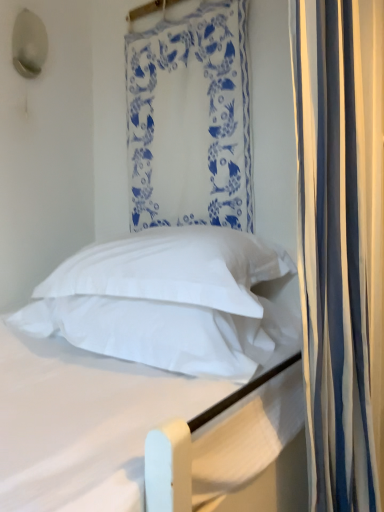
Question: Is white soft bed at center with white fabric at upper center, the 2th curtain when ordered from right to left?

Choices:
 (A) yes
 (B) no

Answer: (B)

Question: From the image's perspective, is white soft bed at center beneath white fabric at upper center, the 2th curtain in the front-to-back sequence?

Choices:
 (A) yes
 (B) no

Answer: (A)

Question: Is white fabric at upper center, positioned as the 1th curtain in left-to-right order, surrounded by white soft bed at center?

Choices:
 (A) yes
 (B) no

Answer: (B)

Question: Does white soft bed at center turn towards white fabric at upper center, placed as the 1th curtain when sorted from back to front?

Choices:
 (A) yes
 (B) no

Answer: (B)

Question: Considering the relative sizes of white soft bed at center and white fabric at upper center, the 2th curtain when ordered from right to left, in the image provided, is white soft bed at center bigger than white fabric at upper center, the 2th curtain when ordered from right to left,?

Choices:
 (A) yes
 (B) no

Answer: (A)

Question: Does white soft bed at center appear on the left side of white fabric at upper center, placed as the 1th curtain when sorted from back to front?

Choices:
 (A) yes
 (B) no

Answer: (A)

Question: Are white soft pillow at center, which is counted as the second pillow, starting from the bottom, and white striped curtain at right, which is counted as the 2th curtain, starting from the back, far apart?

Choices:
 (A) no
 (B) yes

Answer: (A)

Question: From a real-world perspective, is white soft pillow at center, the 1th pillow in the top-to-bottom sequence, positioned over white striped curtain at right, which is counted as the 2th curtain, starting from the back, based on gravity?

Choices:
 (A) yes
 (B) no

Answer: (B)

Question: Considering the relative positions of white soft pillow at center, the 1th pillow in the top-to-bottom sequence, and white striped curtain at right, which is counted as the 2th curtain, starting from the back, in the image provided, is white soft pillow at center, the 1th pillow in the top-to-bottom sequence, to the left of white striped curtain at right, which is counted as the 2th curtain, starting from the back, from the viewer's perspective?

Choices:
 (A) no
 (B) yes

Answer: (B)

Question: From the image's perspective, is white soft pillow at center, the 1th pillow in the top-to-bottom sequence, under white striped curtain at right, which is counted as the 2th curtain, starting from the back?

Choices:
 (A) yes
 (B) no

Answer: (A)

Question: Is white striped curtain at right, which is the first curtain in right-to-left order, at the back of white soft pillow at center, the 1th pillow in the top-to-bottom sequence?

Choices:
 (A) no
 (B) yes

Answer: (A)

Question: From a real-world perspective, is white soft pillow at center, the 1th pillow in the top-to-bottom sequence, located beneath white striped curtain at right, placed as the first curtain when sorted from front to back?

Choices:
 (A) no
 (B) yes

Answer: (B)

Question: From a real-world perspective, is white striped curtain at right, which is the first curtain in right-to-left order, beneath white soft pillow at center, which is counted as the second pillow, starting from the bottom?

Choices:
 (A) yes
 (B) no

Answer: (B)